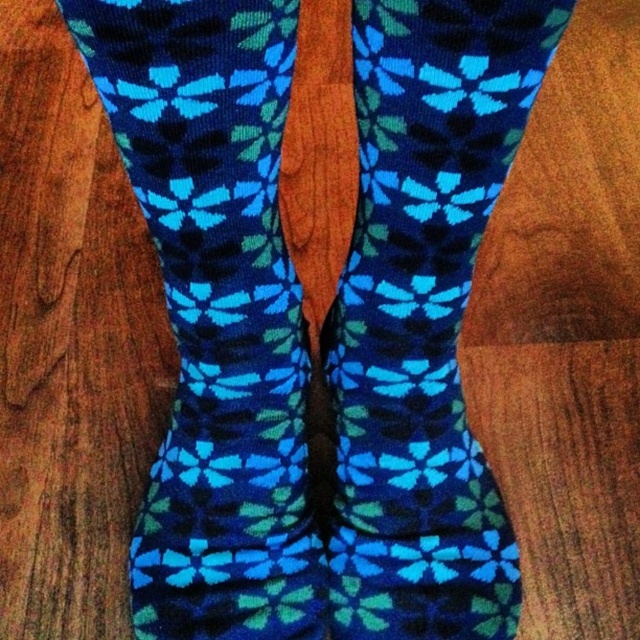
Does blue knitted socks at center appear on the left side of knitted blue socks at center?

Correct, you'll find blue knitted socks at center to the left of knitted blue socks at center.

Describe the element at coordinates (216, 314) in the screenshot. This screenshot has width=640, height=640. I see `blue knitted socks at center` at that location.

Locate an element on the screen. The image size is (640, 640). blue knitted socks at center is located at coordinates (216, 314).